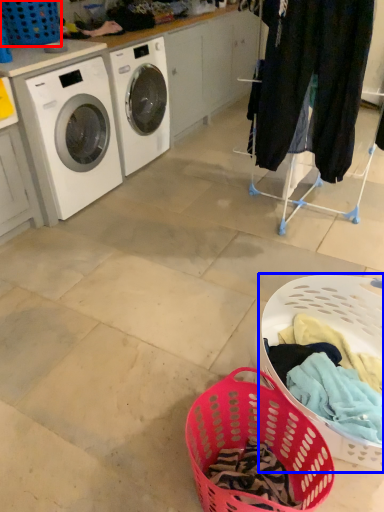
Question: Among these objects, which one is nearest to the camera, basket (highlighted by a red box) or basket (highlighted by a blue box)?

Choices:
 (A) basket
 (B) basket

Answer: (B)